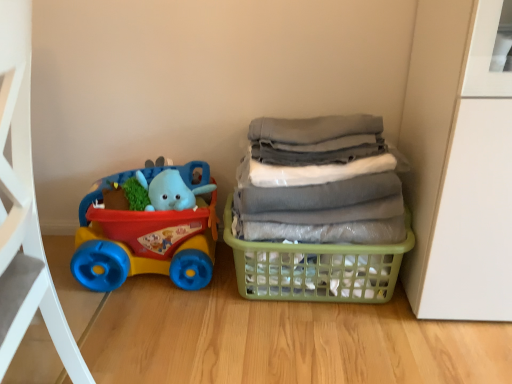
The width and height of the screenshot is (512, 384). Find the location of `gray fabric laundry at right`. gray fabric laundry at right is located at coordinates (319, 182).

Find the location of a particular element. This screenshot has width=512, height=384. green plastic basket at right is located at coordinates (316, 268).

Identify the location of rubberized plastic toy car at left. The image size is (512, 384). (143, 242).

Is green plastic basket at right placed right next to rubberized plastic toy car at left?

No, green plastic basket at right is not beside rubberized plastic toy car at left.

Based on the photo, is the depth of green plastic basket at right less than that of rubberized plastic toy car at left?

Yes, green plastic basket at right is in front of rubberized plastic toy car at left.

From the picture: How different are the orientations of green plastic basket at right and rubberized plastic toy car at left in degrees?

0.000431 degrees separate the facing orientations of green plastic basket at right and rubberized plastic toy car at left.

From the image's perspective, is green plastic basket at right over rubberized plastic toy car at left?

Actually, green plastic basket at right appears below rubberized plastic toy car at left in the image.

Does rubberized plastic toy car at left come behind gray fabric laundry at right?

Yes, rubberized plastic toy car at left is further from the camera.

Is rubberized plastic toy car at left far from gray fabric laundry at right?

No, rubberized plastic toy car at left is not far from gray fabric laundry at right.

The image size is (512, 384). I want to click on laundry on the right of rubberized plastic toy car at left, so click(x=319, y=182).

Is rubberized plastic toy car at left to the right of gray fabric laundry at right from the viewer's perspective?

Incorrect, rubberized plastic toy car at left is not on the right side of gray fabric laundry at right.

Can you confirm if rubberized plastic toy car at left is smaller than green plastic basket at right?

Indeed, rubberized plastic toy car at left has a smaller size compared to green plastic basket at right.

Between point (86, 283) and point (271, 285), which one is positioned in front?

Positioned in front is point (271, 285).

Are rubberized plastic toy car at left and green plastic basket at right far apart?

No.

Would you say green plastic basket at right is part of rubberized plastic toy car at left's contents?

No, green plastic basket at right is not a part of rubberized plastic toy car at left.

From the image's perspective, is green plastic basket at right located above or below gray fabric laundry at right?

From the image's perspective, green plastic basket at right appears below gray fabric laundry at right.

Looking at this image, is the depth of green plastic basket at right greater than that of gray fabric laundry at right?

Yes, green plastic basket at right is further from the viewer.

Is green plastic basket at right far from gray fabric laundry at right?

green plastic basket at right is actually quite close to gray fabric laundry at right.

In the scene shown: From the image's perspective, which is below, gray fabric laundry at right or rubberized plastic toy car at left?

rubberized plastic toy car at left, from the image's perspective.

Is gray fabric laundry at right far from rubberized plastic toy car at left?

gray fabric laundry at right is actually quite close to rubberized plastic toy car at left.

How distant is gray fabric laundry at right from rubberized plastic toy car at left?

gray fabric laundry at right is 33.74 centimeters away from rubberized plastic toy car at left.

From a real-world perspective, is gray fabric laundry at right located higher than rubberized plastic toy car at left?

Yes.

What's the angular difference between gray fabric laundry at right and green plastic basket at right's facing directions?

gray fabric laundry at right and green plastic basket at right are facing 0.000157 degrees away from each other.

From the image's perspective, is gray fabric laundry at right on green plastic basket at right?

Yes.

Based on their sizes in the image, would you say gray fabric laundry at right is bigger or smaller than green plastic basket at right?

In the image, gray fabric laundry at right appears to be larger than green plastic basket at right.

In the image, there is a green plastic basket at right. Where is `toy above it (from the image's perspective)`? toy above it (from the image's perspective) is located at coordinates (143, 242).

Find the location of a particular element. Image resolution: width=512 pixels, height=384 pixels. laundry that appears in front of the rubberized plastic toy car at left is located at coordinates (319, 182).

When comparing their distances from green plastic basket at right, does rubberized plastic toy car at left or gray fabric laundry at right seem further?

rubberized plastic toy car at left lies further to green plastic basket at right than the other object.

Looking at this image, when comparing their distances from gray fabric laundry at right, does green plastic basket at right or rubberized plastic toy car at left seem closer?

green plastic basket at right lies closer to gray fabric laundry at right than the other object.

Looking at this image, when comparing their distances from green plastic basket at right, does gray fabric laundry at right or rubberized plastic toy car at left seem closer?

Based on the image, gray fabric laundry at right appears to be nearer to green plastic basket at right.

Considering their positions, is rubberized plastic toy car at left positioned closer to gray fabric laundry at right than green plastic basket at right?

green plastic basket at right lies closer to gray fabric laundry at right than the other object.

Considering their positions, is green plastic basket at right positioned closer to rubberized plastic toy car at left than gray fabric laundry at right?

green plastic basket at right lies closer to rubberized plastic toy car at left than the other object.

Estimate the real-world distances between objects in this image. Which object is further from rubberized plastic toy car at left, gray fabric laundry at right or green plastic basket at right?

gray fabric laundry at right.

The height and width of the screenshot is (384, 512). Identify the location of basket situated between rubberized plastic toy car at left and gray fabric laundry at right from left to right. (316, 268).